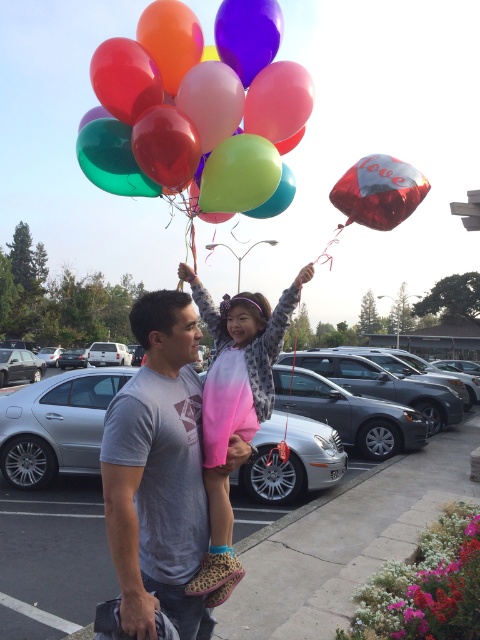
Does gray cotton t-shirt at center have a lesser width compared to pink ombre sweater at center?

Indeed, gray cotton t-shirt at center has a lesser width compared to pink ombre sweater at center.

Based on the photo, is gray cotton t-shirt at center smaller than pink ombre sweater at center?

Correct, gray cotton t-shirt at center occupies less space than pink ombre sweater at center.

From the picture: Who is more forward, [128,547] or [261,305]?

Point [128,547] is in front.

Locate an element on the screen. The image size is (480, 640). gray cotton t-shirt at center is located at coordinates (157, 472).

Which is behind, point (81, 611) or point (396, 160)?

Positioned behind is point (81, 611).

Is gray asphalt parking lot at center thinner than shiny metallic love balloon at upper center?

No.

The image size is (480, 640). I want to click on gray asphalt parking lot at center, so click(x=334, y=525).

You are a GUI agent. You are given a task and a screenshot of the screen. Output one action in this format:
    pyautogui.click(x=<x>, y=<y>)
    Task: Click on the gray asphalt parking lot at center
    
    Given the screenshot: What is the action you would take?
    pyautogui.click(x=334, y=525)

Which is in front, point (12, 528) or point (186, 563)?

Point (186, 563) is in front.

Is point (356, 528) positioned after point (199, 497)?

Yes, point (356, 528) is farther from viewer.

The height and width of the screenshot is (640, 480). Identify the location of gray asphalt parking lot at center. (334, 525).